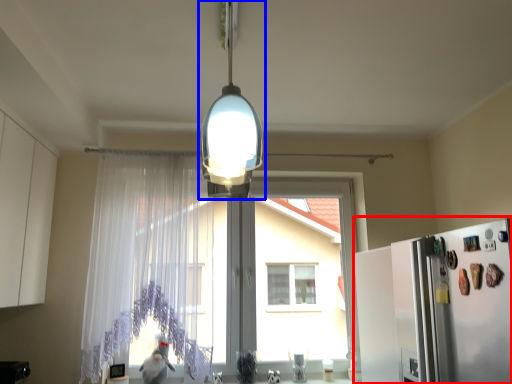
Question: Which of the following is the farthest to the observer, fridge (highlighted by a red box) or lamp (highlighted by a blue box)?

Choices:
 (A) fridge
 (B) lamp

Answer: (A)